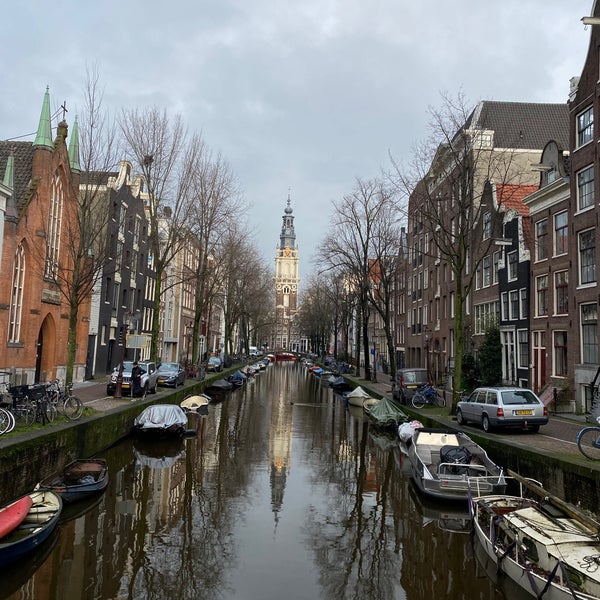
Identify the location of orange walls. (85, 336), (56, 335), (38, 268), (20, 358), (1, 255), (72, 219), (33, 205).